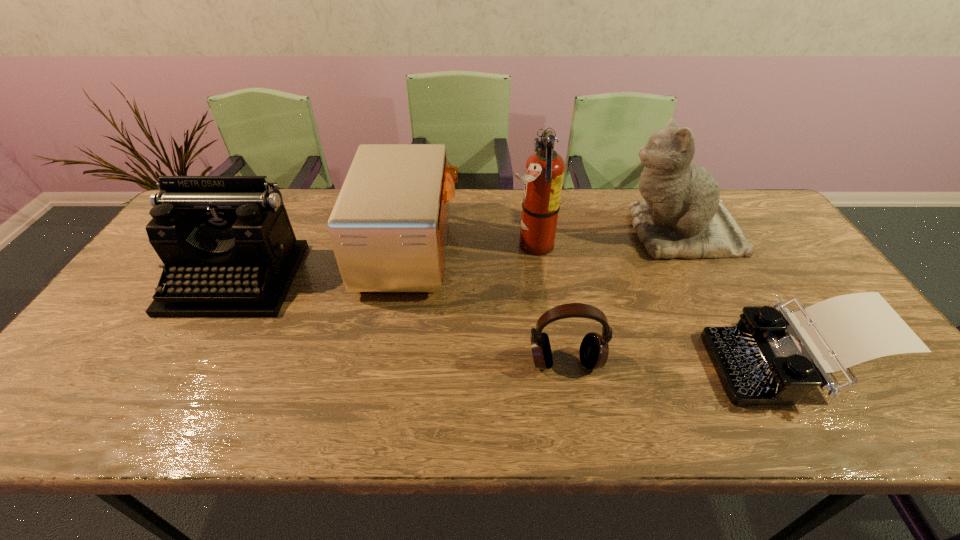
Identify the location of fire extinguisher present at the far edge. Image resolution: width=960 pixels, height=540 pixels. (543, 178).

I want to click on cat that is positioned at the far edge, so click(682, 216).

Image resolution: width=960 pixels, height=540 pixels. I want to click on toaster oven at the far edge, so click(x=388, y=228).

Image resolution: width=960 pixels, height=540 pixels. Identify the location of object that is positioned at the near edge. (773, 356).

Find the location of a particular element. The height and width of the screenshot is (540, 960). object that is at the left edge is located at coordinates (229, 250).

At what (x,y) coordinates should I click in order to perform the action: click on cat located at the right edge. Please return your answer as a coordinate pair (x, y). The height and width of the screenshot is (540, 960). Looking at the image, I should click on 682,216.

Where is `typewriter present at the right edge`? This screenshot has height=540, width=960. typewriter present at the right edge is located at coordinates (773, 356).

The image size is (960, 540). I want to click on object at the far right corner, so click(x=682, y=216).

The image size is (960, 540). I want to click on object at the near right corner, so click(x=773, y=356).

At what (x,y) coordinates should I click in order to perform the action: click on free region at the far edge of the desktop. Please return your answer as a coordinate pair (x, y). Image resolution: width=960 pixels, height=540 pixels. Looking at the image, I should click on (500, 192).